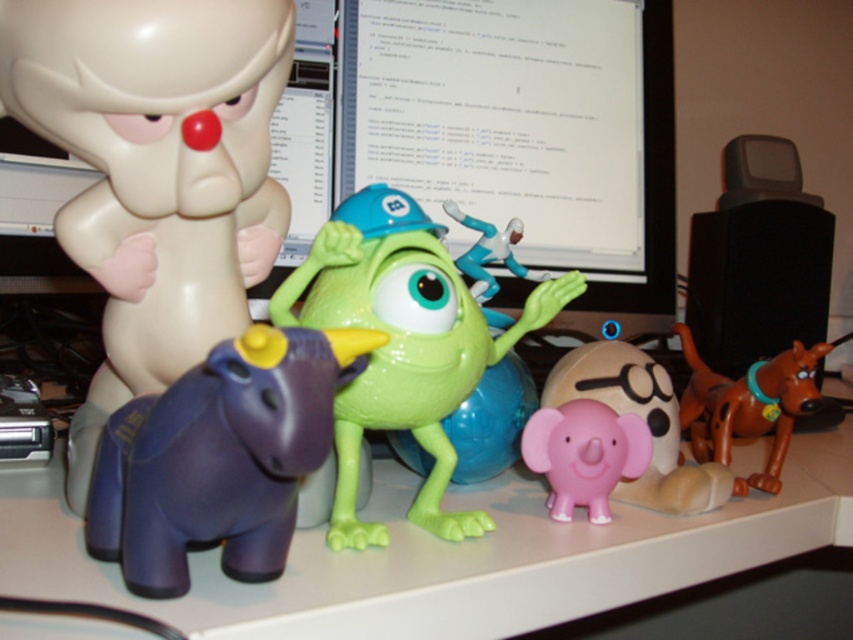
Can you confirm if matte purple elephant at left is smaller than matte plastic toys at center?

Indeed, matte purple elephant at left has a smaller size compared to matte plastic toys at center.

Who is more distant from viewer, [114,92] or [492,576]?

Positioned behind is point [492,576].

Where is `matte purple elephant at left`? This screenshot has width=853, height=640. matte purple elephant at left is located at coordinates (155, 172).

Is matte purple elephant at left to the left of brown rubber dog at right from the viewer's perspective?

Yes, matte purple elephant at left is to the left of brown rubber dog at right.

Does matte purple elephant at left appear on the right side of brown rubber dog at right?

Incorrect, matte purple elephant at left is not on the right side of brown rubber dog at right.

Which is in front, point (260, 13) or point (709, 424)?

Positioned in front is point (260, 13).

The height and width of the screenshot is (640, 853). What are the coordinates of `matte purple elephant at left` in the screenshot? It's located at (155, 172).

Is green glossy toy monster at center positioned in front of brown rubber dog at right?

Yes, it is in front of brown rubber dog at right.

Does point (375, 212) lie in front of point (764, 368)?

Yes, point (375, 212) is closer to viewer.

Between point (305, 280) and point (711, 451), which one is positioned behind?

Point (711, 451)

Where is `green glossy toy monster at center`? This screenshot has width=853, height=640. green glossy toy monster at center is located at coordinates (402, 344).